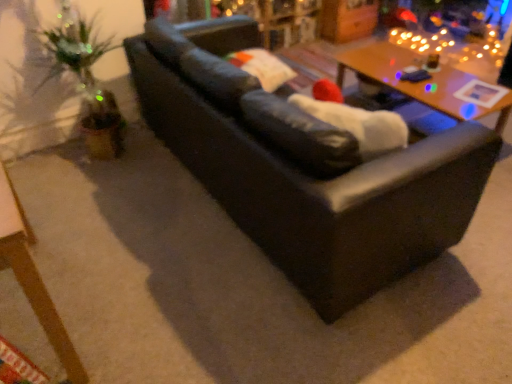
Question: Is wooden table at lower left, the 2th table in the right-to-left sequence, wider than wooden table at upper right, which is the first table from back to front?

Choices:
 (A) no
 (B) yes

Answer: (A)

Question: Considering the relative sizes of wooden table at lower left, the first table in the left-to-right sequence, and wooden table at upper right, acting as the second table starting from the left, in the image provided, is wooden table at lower left, the first table in the left-to-right sequence, smaller than wooden table at upper right, acting as the second table starting from the left,?

Choices:
 (A) yes
 (B) no

Answer: (A)

Question: Is wooden table at lower left, the first table in the left-to-right sequence, taller than wooden table at upper right, which is the first table from back to front?

Choices:
 (A) no
 (B) yes

Answer: (B)

Question: Is the depth of wooden table at lower left, the 2th table in the right-to-left sequence, greater than that of wooden table at upper right, arranged as the first table when viewed from the right?

Choices:
 (A) no
 (B) yes

Answer: (A)

Question: Is wooden table at lower left, acting as the second table starting from the back, outside of wooden table at upper right, arranged as the first table when viewed from the right?

Choices:
 (A) yes
 (B) no

Answer: (A)

Question: From a real-world perspective, is wooden table at lower left, the first table in the left-to-right sequence, beneath wooden table at upper right, acting as the second table starting from the left?

Choices:
 (A) yes
 (B) no

Answer: (B)

Question: Considering the relative sizes of wooden table at lower left, acting as the second table starting from the back, and matte black couch at center in the image provided, is wooden table at lower left, acting as the second table starting from the back, taller than matte black couch at center?

Choices:
 (A) no
 (B) yes

Answer: (A)

Question: Can you confirm if wooden table at lower left, acting as the second table starting from the back, is bigger than matte black couch at center?

Choices:
 (A) yes
 (B) no

Answer: (B)

Question: From the image's perspective, would you say wooden table at lower left, the 1th table positioned from the front, is positioned over matte black couch at center?

Choices:
 (A) no
 (B) yes

Answer: (A)

Question: Considering the relative sizes of wooden table at lower left, the 1th table positioned from the front, and matte black couch at center in the image provided, is wooden table at lower left, the 1th table positioned from the front, thinner than matte black couch at center?

Choices:
 (A) yes
 (B) no

Answer: (A)

Question: Does wooden table at lower left, the 2th table in the right-to-left sequence, have a greater width compared to matte black couch at center?

Choices:
 (A) yes
 (B) no

Answer: (B)

Question: From the image's perspective, is wooden table at lower left, the 2th table in the right-to-left sequence, located beneath matte black couch at center?

Choices:
 (A) no
 (B) yes

Answer: (B)

Question: Can you confirm if matte black couch at center is positioned to the right of wooden table at lower left, the 2th table in the right-to-left sequence?

Choices:
 (A) no
 (B) yes

Answer: (B)